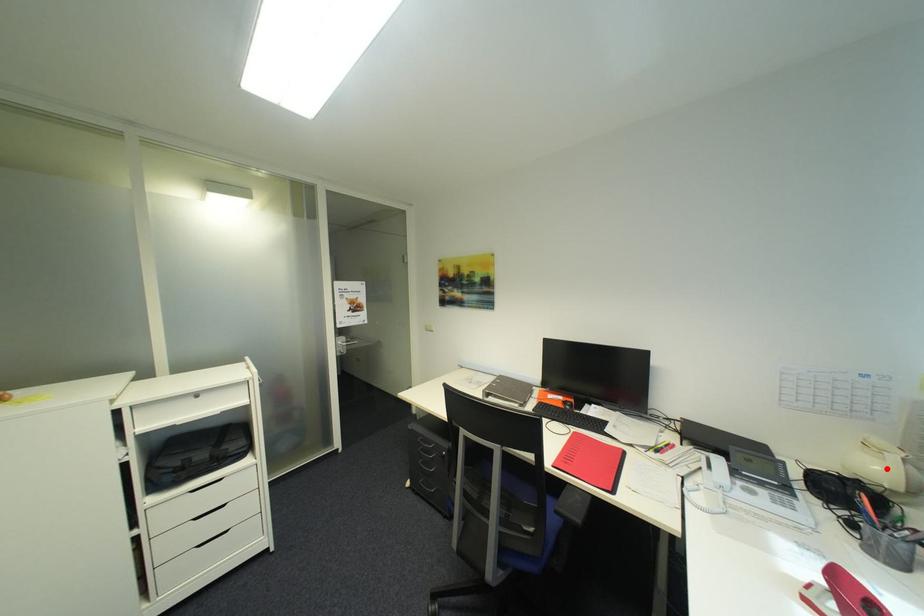
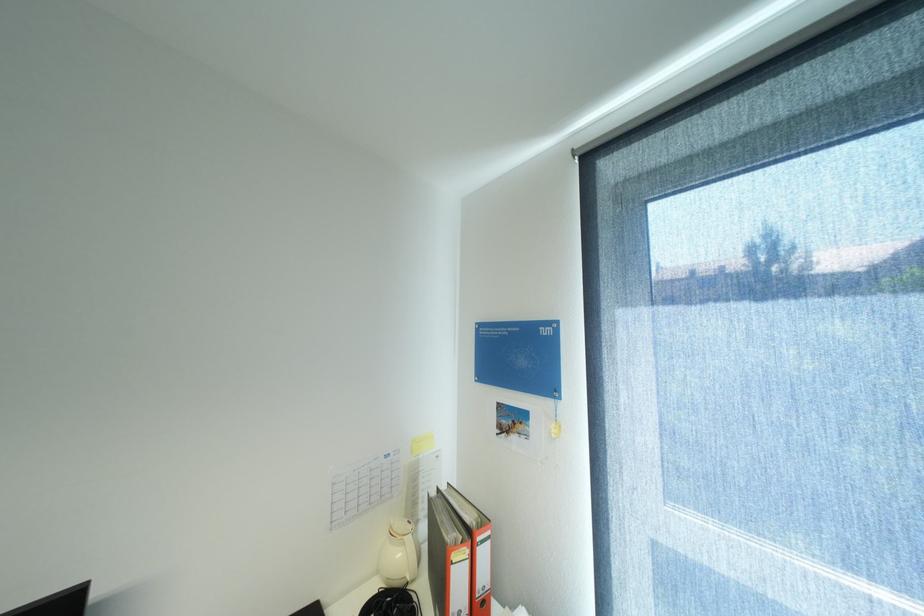
Question: I am providing you with two images of the same scene from different viewpoints. Image1 has a red point marked. In image2, the corresponding 3D location appears at what relative position? Reply with the corresponding letter.

Choices:
 (A) Closer
 (B) Farther

Answer: (B)